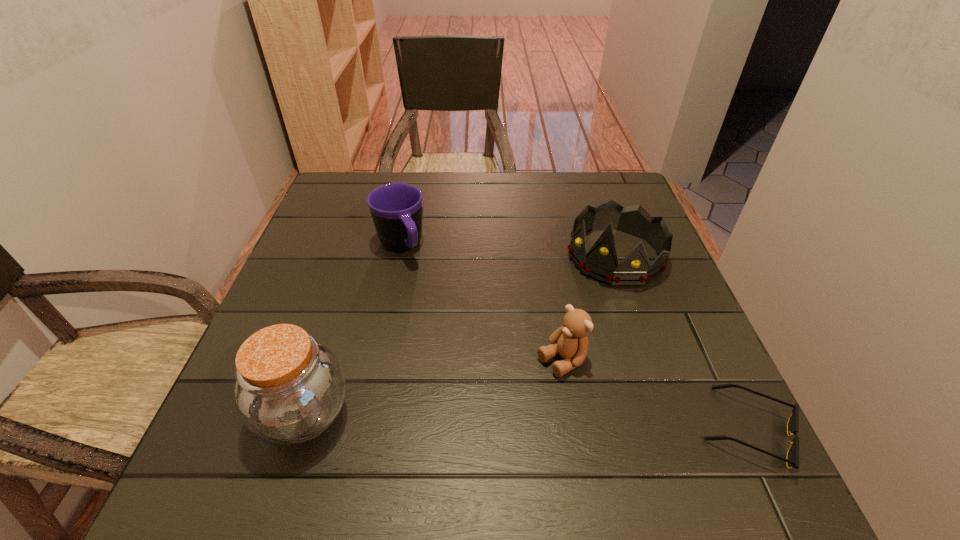
Image resolution: width=960 pixels, height=540 pixels. I want to click on vacant space located 0.100m on the front-facing side of the teddy bear, so click(x=500, y=399).

Identify the location of free space located 0.080m on the front-facing side of the teddy bear. The width and height of the screenshot is (960, 540). (510, 393).

Identify the location of blank space located 0.190m with the handle on the side of the mug. This screenshot has height=540, width=960. (441, 319).

You are a GUI agent. You are given a task and a screenshot of the screen. Output one action in this format:
    pyautogui.click(x=<x>, y=<y>)
    Task: Click on the free spot located with the handle on the side of the mug
    The height and width of the screenshot is (540, 960).
    Given the screenshot: What is the action you would take?
    pyautogui.click(x=444, y=325)

In order to click on vacant space located 0.080m with the handle on the side of the mug in this screenshot , I will do `click(421, 287)`.

Find the location of a particular element. Image resolution: width=960 pixels, height=540 pixels. jar positioned at the near edge is located at coordinates (289, 389).

Locate an element on the screen. sunglasses located in the near edge section of the desktop is located at coordinates (792, 460).

The width and height of the screenshot is (960, 540). Find the location of `object at the left edge`. object at the left edge is located at coordinates (289, 389).

The width and height of the screenshot is (960, 540). I want to click on sunglasses at the right edge, so click(792, 460).

At what (x,y) coordinates should I click in order to perform the action: click on tiara present at the right edge. Please return your answer as a coordinate pair (x, y). The width and height of the screenshot is (960, 540). Looking at the image, I should click on (600, 263).